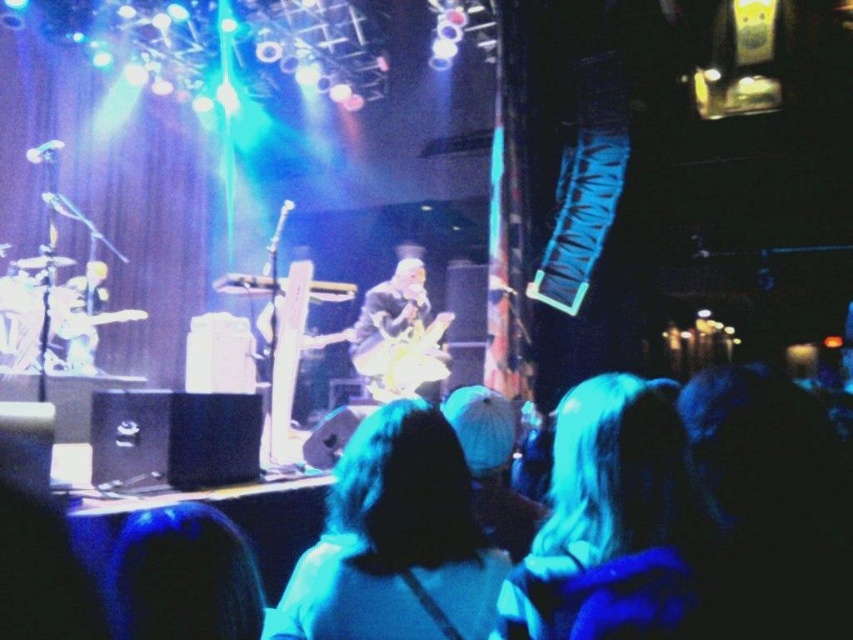
Image resolution: width=853 pixels, height=640 pixels. Describe the element at coordinates (395, 541) in the screenshot. I see `light blue fabric at center` at that location.

Can you confirm if light blue fabric at center is taller than shiny gold guitar at center?

No.

Is point (442, 595) in front of point (393, 372)?

Yes, point (442, 595) is closer to viewer.

Where is `light blue fabric at center`? This screenshot has height=640, width=853. light blue fabric at center is located at coordinates (395, 541).

Is white fabric at center below shiny gold guitar at center?

No.

Who is lower down, white fabric at center or shiny gold guitar at center?

shiny gold guitar at center is below.

Describe the element at coordinates (604, 497) in the screenshot. I see `white fabric at center` at that location.

At what (x,y) coordinates should I click in order to perform the action: click on white fabric at center. Please return your answer as a coordinate pair (x, y). Image resolution: width=853 pixels, height=640 pixels. Looking at the image, I should click on (604, 497).

Based on the photo, is light blue fabric at center behind white fabric at center?

Yes, light blue fabric at center is further from the viewer.

Where is `light blue fabric at center`? Image resolution: width=853 pixels, height=640 pixels. light blue fabric at center is located at coordinates tap(395, 541).